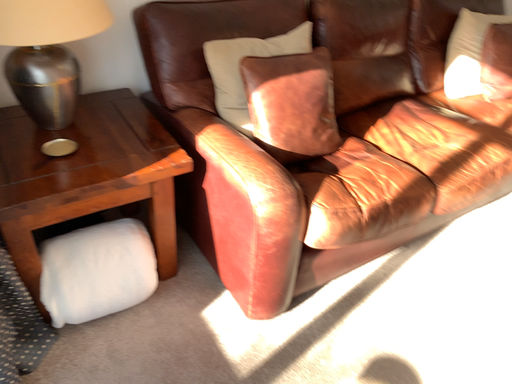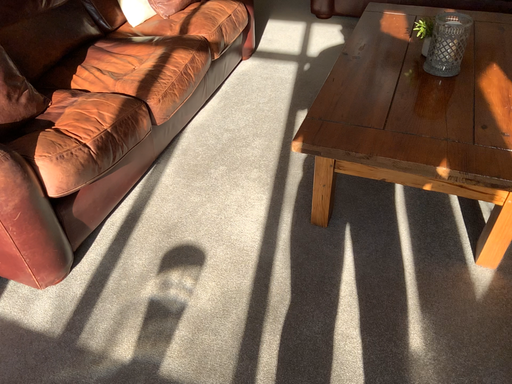
Question: How did the camera likely rotate when shooting the video?

Choices:
 (A) rotated left
 (B) rotated right

Answer: (B)